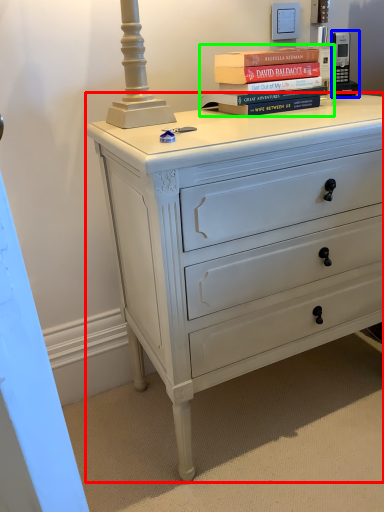
Question: Which object is positioned closest to chest of drawers (highlighted by a red box)? Select from gadget (highlighted by a blue box) and book (highlighted by a green box).

Choices:
 (A) gadget
 (B) book

Answer: (B)